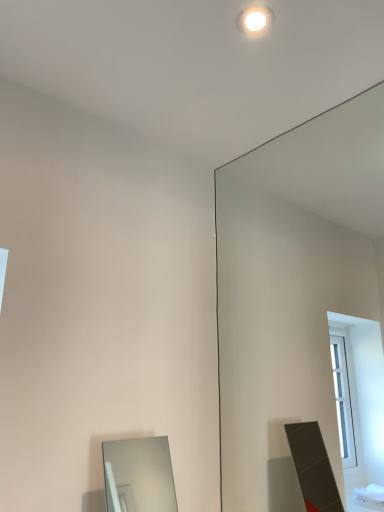
The height and width of the screenshot is (512, 384). What do you see at coordinates (139, 475) in the screenshot? I see `smooth silver mirror at lower left, arranged as the 1th mirror when viewed from the left` at bounding box center [139, 475].

Where is `clear glass mirror at upper right, which ranks as the first mirror in right-to-left order`? clear glass mirror at upper right, which ranks as the first mirror in right-to-left order is located at coordinates (293, 288).

The width and height of the screenshot is (384, 512). Find the location of `white glossy light fixture at upper center`. white glossy light fixture at upper center is located at coordinates (255, 20).

In terms of width, does smooth silver mirror at lower left, acting as the 2th mirror starting from the right, look wider or thinner when compared to clear glass mirror at upper right, the 2th mirror from the left?

Considering their sizes, smooth silver mirror at lower left, acting as the 2th mirror starting from the right, looks broader than clear glass mirror at upper right, the 2th mirror from the left.

Is smooth silver mirror at lower left, arranged as the 1th mirror when viewed from the left, positioned far away from clear glass mirror at upper right, the 2th mirror from the left?

Yes, smooth silver mirror at lower left, arranged as the 1th mirror when viewed from the left, is far from clear glass mirror at upper right, the 2th mirror from the left.

From the image's perspective, would you say smooth silver mirror at lower left, acting as the 2th mirror starting from the right, is positioned over clear glass mirror at upper right, which ranks as the first mirror in right-to-left order?

No, from the image's perspective, smooth silver mirror at lower left, acting as the 2th mirror starting from the right, is not above clear glass mirror at upper right, which ranks as the first mirror in right-to-left order.

Does point (245, 439) come in front of point (172, 485)?

Yes, it is in front of point (172, 485).

Between clear glass mirror at upper right, which ranks as the first mirror in right-to-left order, and smooth silver mirror at lower left, acting as the 2th mirror starting from the right, which one has smaller width?

clear glass mirror at upper right, which ranks as the first mirror in right-to-left order, is thinner.

From the image's perspective, who appears lower, clear glass mirror at upper right, which ranks as the first mirror in right-to-left order, or smooth silver mirror at lower left, arranged as the 1th mirror when viewed from the left?

smooth silver mirror at lower left, arranged as the 1th mirror when viewed from the left, from the image's perspective.

How many degrees apart are the facing directions of clear glass mirror at upper right, the 2th mirror from the left, and smooth silver mirror at lower left, acting as the 2th mirror starting from the right?

88.5 degrees separate the facing orientations of clear glass mirror at upper right, the 2th mirror from the left, and smooth silver mirror at lower left, acting as the 2th mirror starting from the right.

Which of these two, white glossy light fixture at upper center or smooth silver mirror at lower left, arranged as the 1th mirror when viewed from the left, is thinner?

white glossy light fixture at upper center is thinner.

You are a GUI agent. You are given a task and a screenshot of the screen. Output one action in this format:
    pyautogui.click(x=<x>, y=<y>)
    Task: Click on the lighting on the right of smooth silver mirror at lower left, acting as the 2th mirror starting from the right
    This screenshot has width=384, height=512.
    Given the screenshot: What is the action you would take?
    click(255, 20)

Does point (268, 15) appear closer or farther from the camera than point (106, 446)?

Point (268, 15) appears to be closer to the viewer than point (106, 446).

Based on the photo, which object is closer to the camera taking this photo, white glossy light fixture at upper center or smooth silver mirror at lower left, arranged as the 1th mirror when viewed from the left?

smooth silver mirror at lower left, arranged as the 1th mirror when viewed from the left, is in front.

Locate an element on the screen. The height and width of the screenshot is (512, 384). lighting above the clear glass mirror at upper right, the 2th mirror from the left (from the image's perspective) is located at coordinates (255, 20).

Who is smaller, white glossy light fixture at upper center or clear glass mirror at upper right, the 2th mirror from the left?

With smaller size is white glossy light fixture at upper center.

Does white glossy light fixture at upper center have a lesser height compared to clear glass mirror at upper right, the 2th mirror from the left?

Yes.

Is white glossy light fixture at upper center inside the boundaries of clear glass mirror at upper right, the 2th mirror from the left, or outside?

white glossy light fixture at upper center cannot be found inside clear glass mirror at upper right, the 2th mirror from the left.

In terms of height, does clear glass mirror at upper right, which ranks as the first mirror in right-to-left order, look taller or shorter compared to white glossy light fixture at upper center?

Clearly, clear glass mirror at upper right, which ranks as the first mirror in right-to-left order, is taller compared to white glossy light fixture at upper center.

Could you measure the distance between clear glass mirror at upper right, which ranks as the first mirror in right-to-left order, and white glossy light fixture at upper center?

clear glass mirror at upper right, which ranks as the first mirror in right-to-left order, and white glossy light fixture at upper center are 3.80 feet apart from each other.

From the image's perspective, relative to white glossy light fixture at upper center, is clear glass mirror at upper right, the 2th mirror from the left, above or below?

clear glass mirror at upper right, the 2th mirror from the left, is situated lower than white glossy light fixture at upper center in the image.

Does clear glass mirror at upper right, which ranks as the first mirror in right-to-left order, turn towards white glossy light fixture at upper center?

Yes, clear glass mirror at upper right, which ranks as the first mirror in right-to-left order, is aimed at white glossy light fixture at upper center.

Is smooth silver mirror at lower left, acting as the 2th mirror starting from the right, oriented away from white glossy light fixture at upper center?

No, smooth silver mirror at lower left, acting as the 2th mirror starting from the right, is not facing the opposite direction of white glossy light fixture at upper center.

Is smooth silver mirror at lower left, acting as the 2th mirror starting from the right, at the left side of white glossy light fixture at upper center?

Yes, smooth silver mirror at lower left, acting as the 2th mirror starting from the right, is to the left of white glossy light fixture at upper center.

How many degrees apart are the facing directions of smooth silver mirror at lower left, acting as the 2th mirror starting from the right, and white glossy light fixture at upper center?

2.45 degrees separate the facing orientations of smooth silver mirror at lower left, acting as the 2th mirror starting from the right, and white glossy light fixture at upper center.

Is there a large distance between smooth silver mirror at lower left, acting as the 2th mirror starting from the right, and white glossy light fixture at upper center?

smooth silver mirror at lower left, acting as the 2th mirror starting from the right, is positioned a significant distance from white glossy light fixture at upper center.

The image size is (384, 512). I want to click on mirror on the left side of clear glass mirror at upper right, the 2th mirror from the left, so click(x=139, y=475).

Locate an element on the screen. Image resolution: width=384 pixels, height=512 pixels. mirror on the right of smooth silver mirror at lower left, acting as the 2th mirror starting from the right is located at coordinates (293, 288).

Estimate the real-world distances between objects in this image. Which object is closer to white glossy light fixture at upper center, clear glass mirror at upper right, the 2th mirror from the left, or smooth silver mirror at lower left, acting as the 2th mirror starting from the right?

clear glass mirror at upper right, the 2th mirror from the left.

Estimate the real-world distances between objects in this image. Which object is closer to smooth silver mirror at lower left, acting as the 2th mirror starting from the right, clear glass mirror at upper right, which ranks as the first mirror in right-to-left order, or white glossy light fixture at upper center?

clear glass mirror at upper right, which ranks as the first mirror in right-to-left order, is closer to smooth silver mirror at lower left, acting as the 2th mirror starting from the right.

Which object lies further to the anchor point white glossy light fixture at upper center, smooth silver mirror at lower left, acting as the 2th mirror starting from the right, or clear glass mirror at upper right, which ranks as the first mirror in right-to-left order?

smooth silver mirror at lower left, acting as the 2th mirror starting from the right, is further to white glossy light fixture at upper center.

Estimate the real-world distances between objects in this image. Which object is further from clear glass mirror at upper right, which ranks as the first mirror in right-to-left order, smooth silver mirror at lower left, arranged as the 1th mirror when viewed from the left, or white glossy light fixture at upper center?

Among the two, smooth silver mirror at lower left, arranged as the 1th mirror when viewed from the left, is located further to clear glass mirror at upper right, which ranks as the first mirror in right-to-left order.

Looking at the image, which one is located further to smooth silver mirror at lower left, acting as the 2th mirror starting from the right, white glossy light fixture at upper center or clear glass mirror at upper right, the 2th mirror from the left?

Based on the image, white glossy light fixture at upper center appears to be further to smooth silver mirror at lower left, acting as the 2th mirror starting from the right.

Estimate the real-world distances between objects in this image. Which object is further from clear glass mirror at upper right, which ranks as the first mirror in right-to-left order, white glossy light fixture at upper center or smooth silver mirror at lower left, acting as the 2th mirror starting from the right?

Among the two, smooth silver mirror at lower left, acting as the 2th mirror starting from the right, is located further to clear glass mirror at upper right, which ranks as the first mirror in right-to-left order.

This screenshot has width=384, height=512. What are the coordinates of `mirror between white glossy light fixture at upper center and smooth silver mirror at lower left, arranged as the 1th mirror when viewed from the left, from top to bottom` in the screenshot? It's located at (293, 288).